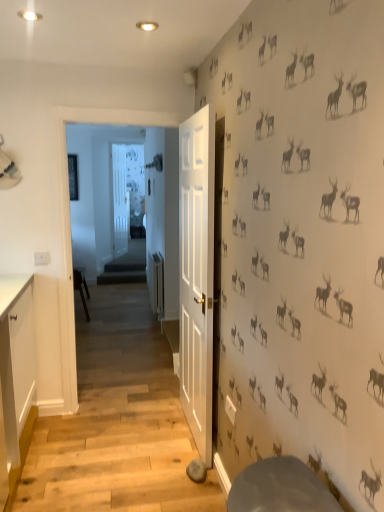
Question: Is white glossy cabinet at left completely or partially inside white wooden door at center?

Choices:
 (A) no
 (B) yes

Answer: (A)

Question: Is white wooden door at center located outside white glossy cabinet at left?

Choices:
 (A) yes
 (B) no

Answer: (A)

Question: Can you confirm if white wooden door at center is positioned to the right of white glossy cabinet at left?

Choices:
 (A) no
 (B) yes

Answer: (A)

Question: From the image's perspective, is white wooden door at center above white glossy cabinet at left?

Choices:
 (A) yes
 (B) no

Answer: (A)

Question: Is white wooden door at center shorter than white glossy cabinet at left?

Choices:
 (A) no
 (B) yes

Answer: (A)

Question: Is white wooden door at center further to the viewer compared to white glossy cabinet at left?

Choices:
 (A) no
 (B) yes

Answer: (B)

Question: Is white glossy cabinet at left facing away from white wooden door at center?

Choices:
 (A) no
 (B) yes

Answer: (A)

Question: Is white glossy cabinet at left with white wooden door at center?

Choices:
 (A) yes
 (B) no

Answer: (B)

Question: Are white glossy cabinet at left and white wooden door at center far apart?

Choices:
 (A) no
 (B) yes

Answer: (B)

Question: Considering the relative sizes of white glossy cabinet at left and white wooden door at center in the image provided, is white glossy cabinet at left thinner than white wooden door at center?

Choices:
 (A) yes
 (B) no

Answer: (B)

Question: Can you confirm if white glossy cabinet at left is positioned to the right of white wooden door at center?

Choices:
 (A) no
 (B) yes

Answer: (B)

Question: Considering the relative sizes of white glossy cabinet at left and white wooden door at center in the image provided, is white glossy cabinet at left bigger than white wooden door at center?

Choices:
 (A) yes
 (B) no

Answer: (A)

Question: Based on their positions, is white glossy cabinet at left located to the left or right of white wooden door at center?

Choices:
 (A) right
 (B) left

Answer: (A)